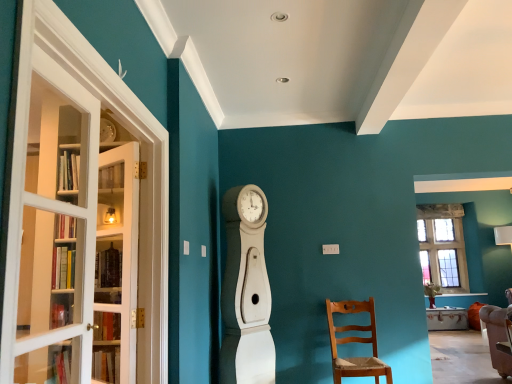
Question: Can you confirm if white glass door at left is shorter than light brown wooden chair at lower right?

Choices:
 (A) no
 (B) yes

Answer: (A)

Question: From a real-world perspective, does white glass door at left sit lower than light brown wooden chair at lower right?

Choices:
 (A) yes
 (B) no

Answer: (B)

Question: Would you say white glass door at left is outside light brown wooden chair at lower right?

Choices:
 (A) no
 (B) yes

Answer: (B)

Question: Is white glass door at left wider than light brown wooden chair at lower right?

Choices:
 (A) yes
 (B) no

Answer: (B)

Question: Can you confirm if white glass door at left is smaller than light brown wooden chair at lower right?

Choices:
 (A) yes
 (B) no

Answer: (A)

Question: In the image, is white glass door at left positioned in front of or behind light brown wooden chair at lower right?

Choices:
 (A) front
 (B) behind

Answer: (A)

Question: From a real-world perspective, is white glass door at left physically located above or below light brown wooden chair at lower right?

Choices:
 (A) below
 (B) above

Answer: (B)

Question: Is point (96, 258) closer or farther from the camera than point (342, 304)?

Choices:
 (A) closer
 (B) farther

Answer: (A)

Question: Considering the positions of white glass door at left and light brown wooden chair at lower right in the image, is white glass door at left wider or thinner than light brown wooden chair at lower right?

Choices:
 (A) thin
 (B) wide

Answer: (A)

Question: Is white glass screen door at left bigger or smaller than white glass door at left?

Choices:
 (A) small
 (B) big

Answer: (B)

Question: Is white glass screen door at left situated inside white glass door at left or outside?

Choices:
 (A) inside
 (B) outside

Answer: (B)

Question: In the image, is white glass screen door at left on the left side or the right side of white glass door at left?

Choices:
 (A) right
 (B) left

Answer: (A)

Question: Is point (26, 109) positioned closer to the camera than point (128, 167)?

Choices:
 (A) farther
 (B) closer

Answer: (B)

Question: From a real-world perspective, is white glass screen door at left above or below white wood clock at center?

Choices:
 (A) below
 (B) above

Answer: (B)

Question: In the image, is white glass screen door at left positioned in front of or behind white wood clock at center?

Choices:
 (A) behind
 (B) front

Answer: (B)